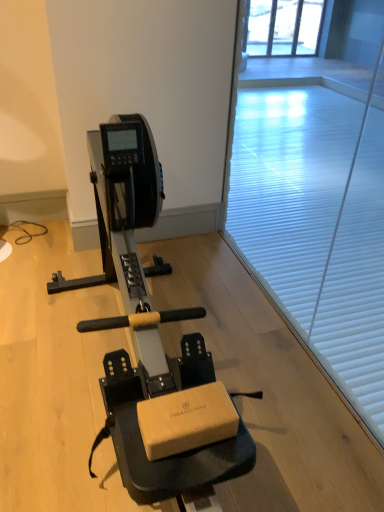
Locate an element on the screen. vacant space in matte black stationary bicycle at center (from a real-world perspective) is located at coordinates (169, 354).